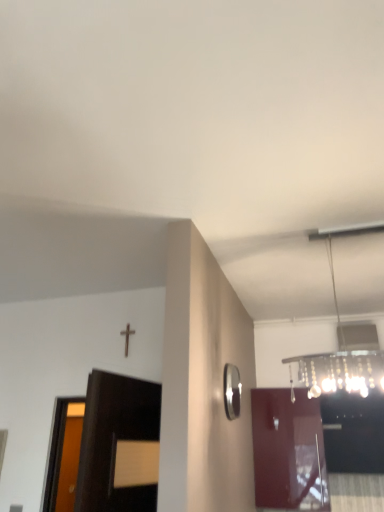
Question: Is clear glass chandelier at upper right smaller than glossy wood door at center?

Choices:
 (A) no
 (B) yes

Answer: (A)

Question: Is glossy wood door at center surrounded by clear glass chandelier at upper right?

Choices:
 (A) yes
 (B) no

Answer: (B)

Question: Does clear glass chandelier at upper right come behind glossy wood door at center?

Choices:
 (A) no
 (B) yes

Answer: (A)

Question: From a real-world perspective, is clear glass chandelier at upper right located higher than glossy wood door at center?

Choices:
 (A) yes
 (B) no

Answer: (A)

Question: From the image's perspective, is clear glass chandelier at upper right above glossy wood door at center?

Choices:
 (A) no
 (B) yes

Answer: (B)

Question: From a real-world perspective, does clear glass chandelier at upper right sit lower than glossy wood door at center?

Choices:
 (A) yes
 (B) no

Answer: (B)

Question: Does clear glass chandelier at upper right touch polished silver mirror at right?

Choices:
 (A) no
 (B) yes

Answer: (A)

Question: Is clear glass chandelier at upper right thinner than polished silver mirror at right?

Choices:
 (A) yes
 (B) no

Answer: (B)

Question: Is clear glass chandelier at upper right facing away from polished silver mirror at right?

Choices:
 (A) yes
 (B) no

Answer: (B)

Question: From a real-world perspective, is clear glass chandelier at upper right located higher than polished silver mirror at right?

Choices:
 (A) no
 (B) yes

Answer: (B)

Question: Is clear glass chandelier at upper right shorter than polished silver mirror at right?

Choices:
 (A) yes
 (B) no

Answer: (B)

Question: Does clear glass chandelier at upper right have a greater height compared to polished silver mirror at right?

Choices:
 (A) yes
 (B) no

Answer: (A)

Question: Can you confirm if glossy wood door at center is wider than clear glass chandelier at upper right?

Choices:
 (A) yes
 (B) no

Answer: (B)